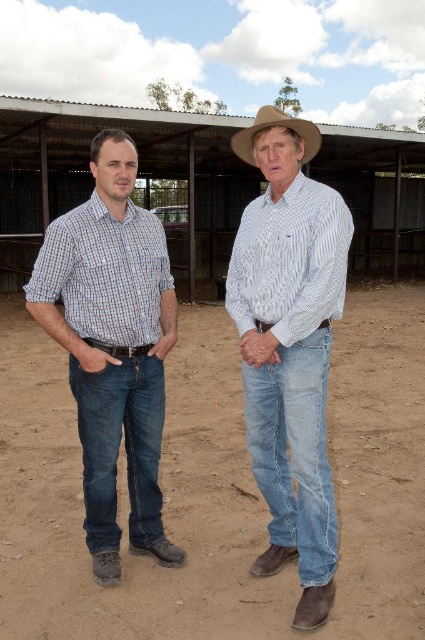
You are designing a new clothing line and need to know the relative sizes of two items in the image. Which item has a smaller width between the white striped shirt at center and the brown leather cowboy hat at center?

The white striped shirt at center is thinner than the brown leather cowboy hat at center, so the white striped shirt at center has a smaller width.

You are a photographer trying to capture both the white striped shirt at center and the checkered fabric shirt at left in a single frame. Based on their heights, which shirt should you focus on to ensure both are fully visible in the photo?

The white striped shirt at center is taller than the checkered fabric shirt at left, so focusing on the white striped shirt at center will help ensure both are fully visible in the photo.